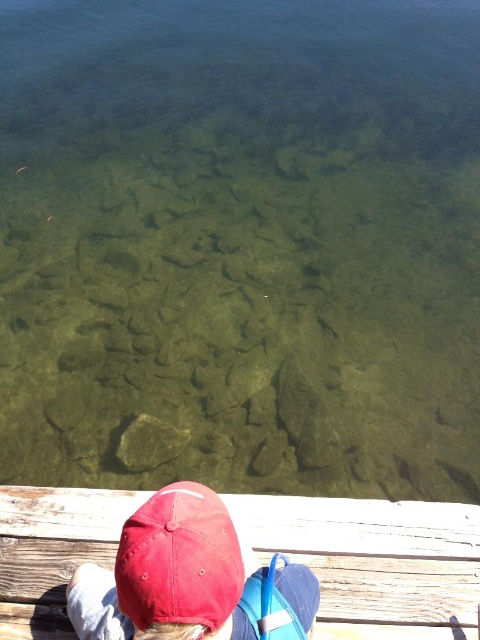
Between wooden dock at lower center and matte red baseball cap at lower left, which one is positioned lower?

wooden dock at lower center is below.

Which is above, wooden dock at lower center or matte red baseball cap at lower left?

Positioned higher is matte red baseball cap at lower left.

Between point (35, 552) and point (180, 534), which one is positioned behind?

Point (35, 552)

You are a GUI agent. You are given a task and a screenshot of the screen. Output one action in this format:
    pyautogui.click(x=<x>, y=<y>)
    Task: Click on the wooden dock at lower center
    
    Given the screenshot: What is the action you would take?
    (374, 561)